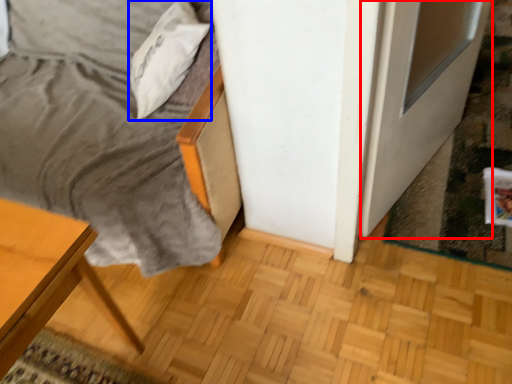
Question: Which object is further to the camera taking this photo, screen door (highlighted by a red box) or pillow (highlighted by a blue box)?

Choices:
 (A) screen door
 (B) pillow

Answer: (B)